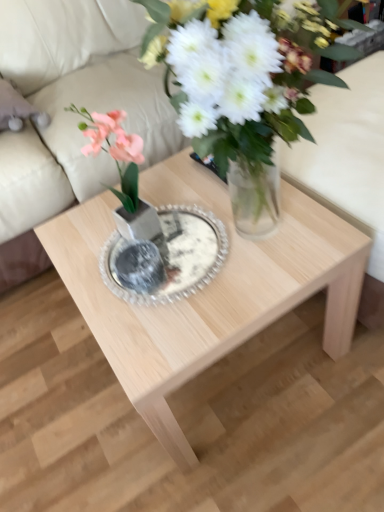
You are a GUI agent. You are given a task and a screenshot of the screen. Output one action in this format:
    pyautogui.click(x=<x>, y=<y>)
    Task: Click on the vacant point above clear glass plate at center (from a real-world perspective)
    
    Given the screenshot: What is the action you would take?
    pyautogui.click(x=182, y=245)